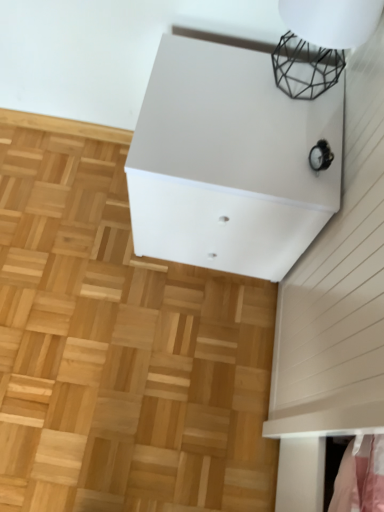
Where is `vacant space situated on the left part of black wire mesh at upper right`? The width and height of the screenshot is (384, 512). vacant space situated on the left part of black wire mesh at upper right is located at coordinates (221, 78).